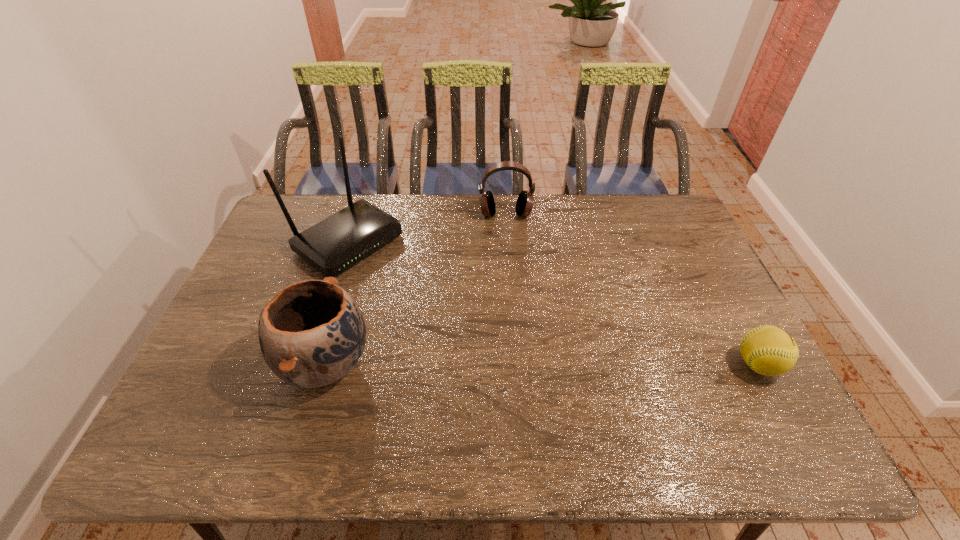
At what (x,y) coordinates should I click in order to perform the action: click on pottery. Please return your answer as a coordinate pair (x, y). Image resolution: width=960 pixels, height=540 pixels. Looking at the image, I should click on (312, 333).

Where is `the shortest object`? The width and height of the screenshot is (960, 540). the shortest object is located at coordinates (768, 350).

Image resolution: width=960 pixels, height=540 pixels. Find the location of `the rightmost object`. the rightmost object is located at coordinates (768, 350).

The image size is (960, 540). In order to click on headset in this screenshot , I will do `click(525, 200)`.

At what (x,y) coordinates should I click in order to perform the action: click on router. Please return your answer as a coordinate pair (x, y). Looking at the image, I should click on (333, 245).

Identify the location of vacant space located 0.070m on the left of the pottery. (252, 363).

At what (x,y) coordinates should I click in order to perform the action: click on free point located 0.110m on the ear pads of the headset. Please return your answer as a coordinate pair (x, y). The width and height of the screenshot is (960, 540). Looking at the image, I should click on (508, 243).

Find the location of a particular element. The width and height of the screenshot is (960, 540). vacant region located 0.250m on the ear pads of the headset is located at coordinates (510, 272).

The image size is (960, 540). Find the location of `free space located on the ear pads of the headset`. free space located on the ear pads of the headset is located at coordinates (509, 257).

Identify the location of vacant region located 0.260m on the front-facing side of the tallest object. The height and width of the screenshot is (540, 960). pyautogui.click(x=443, y=308).